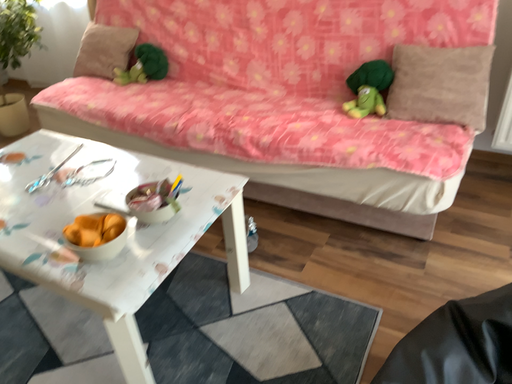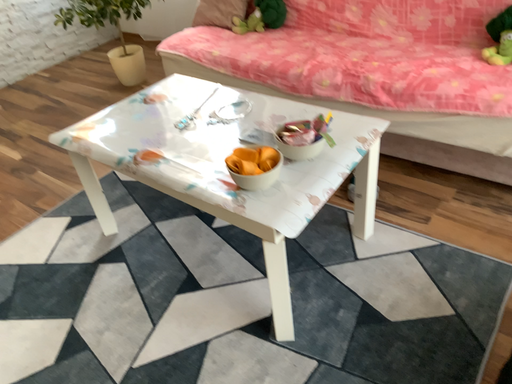
Question: How did the camera likely rotate when shooting the video?

Choices:
 (A) rotated right
 (B) rotated left

Answer: (B)